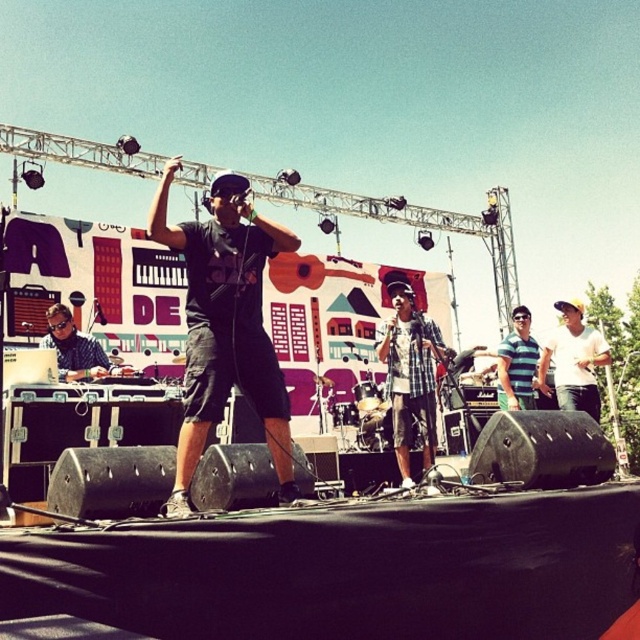
You are a photographer at the music event and want to capture both performers wearing the checkered fabric shirt at center and the white cotton shirt at center in the same frame. Which performer should you position to your left to ensure both are in the shot?

The checkered fabric shirt at center is to the left of white cotton shirt at center, so you should position the performer in the checkered fabric shirt at center to your left to include both in the frame.

You are a photographer at the music performance. You want to capture a photo of both the checkered fabric shirt at center and the blue striped shirt at center in the same frame. Based on their positions and sizes, which shirt should you focus on to ensure both are clearly visible in the photo?

The checkered fabric shirt at center might be wider than blue striped shirt at center, so focusing on the checkered fabric shirt at center would help ensure both are visible as it occupies more space.

You are standing on the stage and see two points marked on the floor at coordinates point (x=577, y=321) and point (x=516, y=328). Which point is closer to the audience?

Point (x=577, y=321) is in front of point (x=516, y=328), so it is closer to the audience.